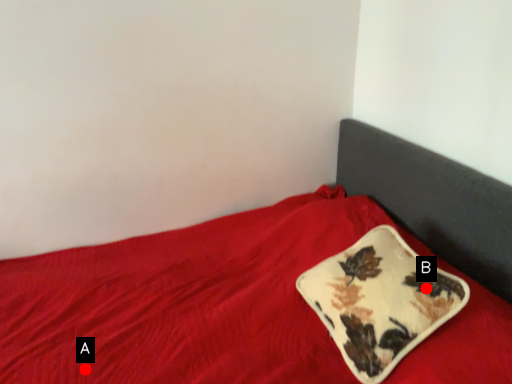
Question: Two points are circled on the image, labeled by A and B beside each circle. Which of the following is the closest to the observer?

Choices:
 (A) A is closer
 (B) B is closer

Answer: (B)